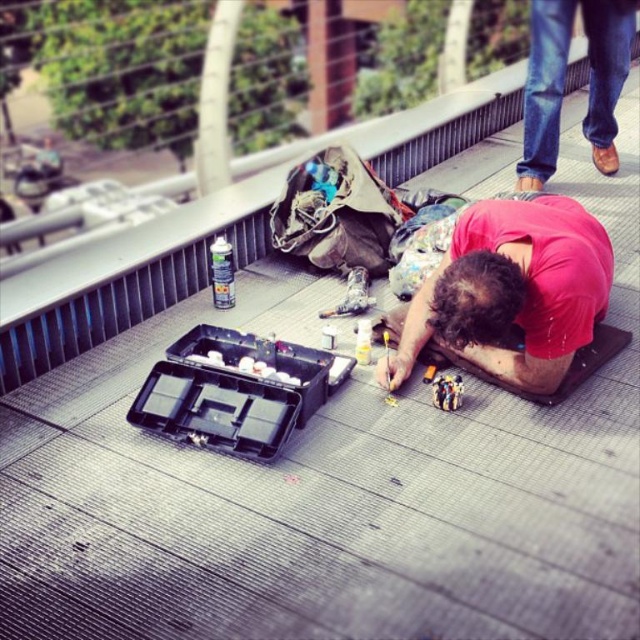
Who is shorter, red matte shirt at center or brown leather shoes at upper right?

red matte shirt at center is shorter.

The width and height of the screenshot is (640, 640). What do you see at coordinates (509, 292) in the screenshot?
I see `red matte shirt at center` at bounding box center [509, 292].

I want to click on red matte shirt at center, so click(x=509, y=292).